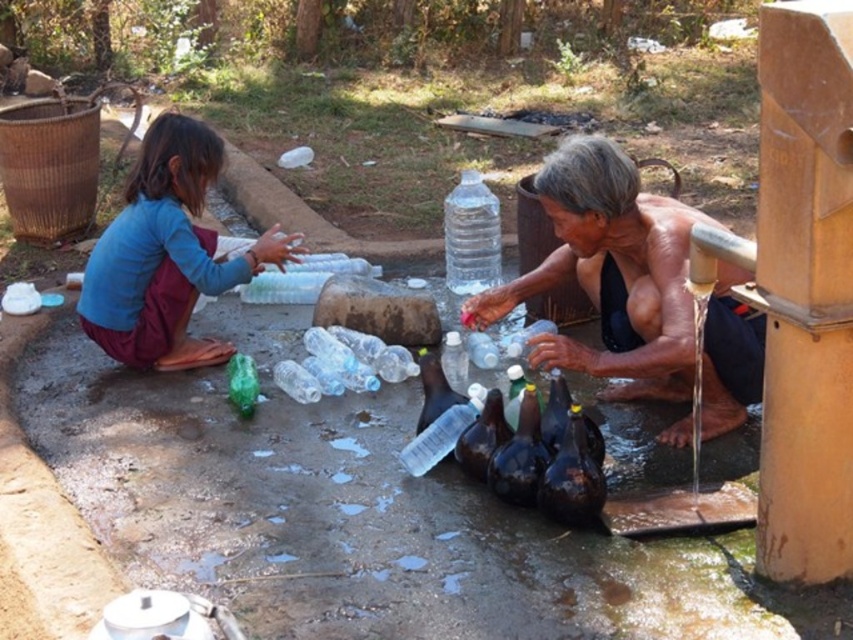
Between point (619, 186) and point (144, 157), which one is positioned behind?

Point (144, 157)

Is translucent plastic bottle at lower center positioned in front of blue fabric pants at left?

Yes, translucent plastic bottle at lower center is in front of blue fabric pants at left.

Identify the location of translucent plastic bottle at lower center. (610, 273).

The height and width of the screenshot is (640, 853). I want to click on translucent plastic bottle at lower center, so click(610, 273).

Does point (200, 125) lie behind point (453, 336)?

Yes, point (200, 125) is behind point (453, 336).

Is blue fabric pants at left smaller than translucent plastic bottle at center?

Actually, blue fabric pants at left might be larger than translucent plastic bottle at center.

Measure the distance between point (164, 221) and camera.

Point (164, 221) and camera are 3.67 meters apart from each other.

This screenshot has height=640, width=853. Find the location of `blue fabric pants at left`. blue fabric pants at left is located at coordinates (166, 253).

Is translucent plastic bottle at lower center to the left of translucent plastic bottle at center from the viewer's perspective?

In fact, translucent plastic bottle at lower center is to the right of translucent plastic bottle at center.

Is point (664, 317) more distant than point (457, 388)?

That is False.

Identify the location of translucent plastic bottle at lower center. (610, 273).

The height and width of the screenshot is (640, 853). Find the location of `translucent plastic bottle at lower center`. translucent plastic bottle at lower center is located at coordinates (610, 273).